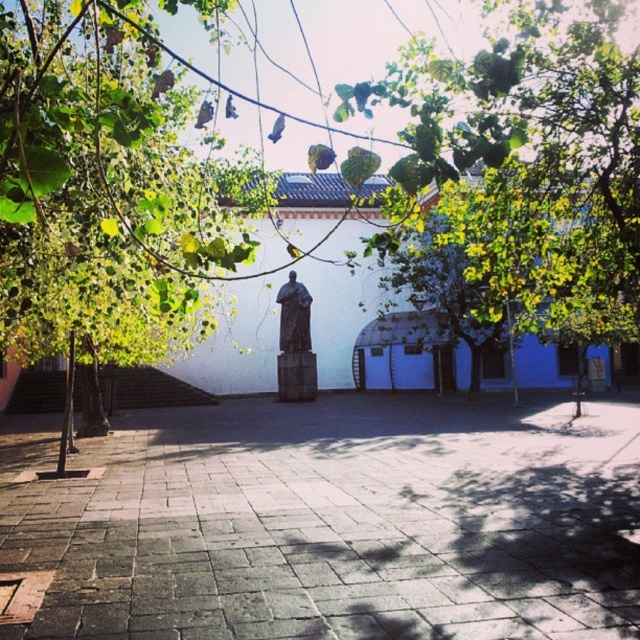
Consider the image. You are standing in the courtyard and want to take a photo of the bronze statue at center without any obstruction. Is there a risk that the green leafy tree at center will block the statue in the photo?

The green leafy tree at center might be wider than bronze statue at center, so there is a risk that the tree could block the statue in the photo depending on their positions.

You are standing in the courtyard and want to walk from the gray stone pavement at center to the green leafy tree at center. Which direction should you move to reach the tree?

The gray stone pavement at center is wider than the green leafy tree at center, so you should move towards the narrower area to reach the green leafy tree at center.